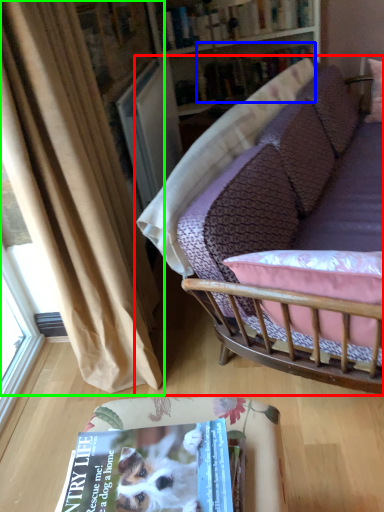
Question: Estimate the real-world distances between objects in this image. Which object is farther from studio couch (highlighted by a red box), book (highlighted by a blue box) or curtain (highlighted by a green box)?

Choices:
 (A) book
 (B) curtain

Answer: (A)